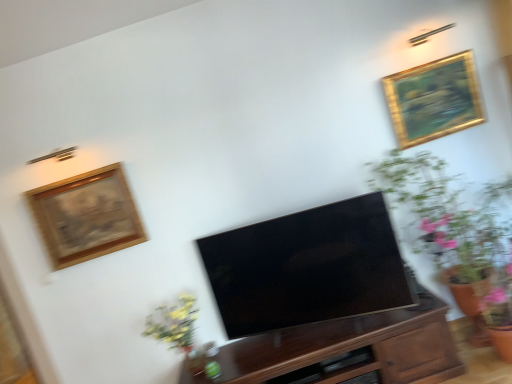
Question: Is the depth of gold/gilded picture frame at upper right, acting as the 1th picture frame starting from the right, greater than that of wooden drawer at center?

Choices:
 (A) no
 (B) yes

Answer: (B)

Question: From the image's perspective, is gold/gilded picture frame at upper right, placed as the second picture frame when sorted from bottom to top, located beneath wooden drawer at center?

Choices:
 (A) no
 (B) yes

Answer: (A)

Question: Does gold/gilded picture frame at upper right, placed as the second picture frame when sorted from bottom to top, have a lesser width compared to wooden drawer at center?

Choices:
 (A) no
 (B) yes

Answer: (B)

Question: Is there a large distance between gold/gilded picture frame at upper right, the second picture frame from the left, and wooden drawer at center?

Choices:
 (A) yes
 (B) no

Answer: (A)

Question: Is gold/gilded picture frame at upper right, the second picture frame from the left, next to wooden drawer at center and touching it?

Choices:
 (A) yes
 (B) no

Answer: (B)

Question: From a real-world perspective, is gold/gilded picture frame at upper right, placed as the second picture frame when sorted from bottom to top, located higher than wooden drawer at center?

Choices:
 (A) yes
 (B) no

Answer: (A)

Question: From a real-world perspective, is wooden framed artwork at upper left, the first picture frame positioned from the bottom, located higher than matte black tv at center?

Choices:
 (A) no
 (B) yes

Answer: (B)

Question: Is wooden framed artwork at upper left, which is counted as the second picture frame, starting from the top, facing away from matte black tv at center?

Choices:
 (A) no
 (B) yes

Answer: (A)

Question: Does wooden framed artwork at upper left, the first picture frame positioned from the bottom, lie in front of matte black tv at center?

Choices:
 (A) no
 (B) yes

Answer: (A)

Question: Is wooden framed artwork at upper left, which is counted as the second picture frame, starting from the top, shorter than matte black tv at center?

Choices:
 (A) no
 (B) yes

Answer: (B)

Question: Considering the relative sizes of wooden framed artwork at upper left, marked as the second picture frame in a right-to-left arrangement, and matte black tv at center in the image provided, is wooden framed artwork at upper left, marked as the second picture frame in a right-to-left arrangement, thinner than matte black tv at center?

Choices:
 (A) no
 (B) yes

Answer: (B)

Question: Does wooden framed artwork at upper left, which is counted as the second picture frame, starting from the top, have a greater height compared to matte black tv at center?

Choices:
 (A) no
 (B) yes

Answer: (A)

Question: Is wooden drawer at center further to the viewer compared to dark wood cabinet at center?

Choices:
 (A) yes
 (B) no

Answer: (A)